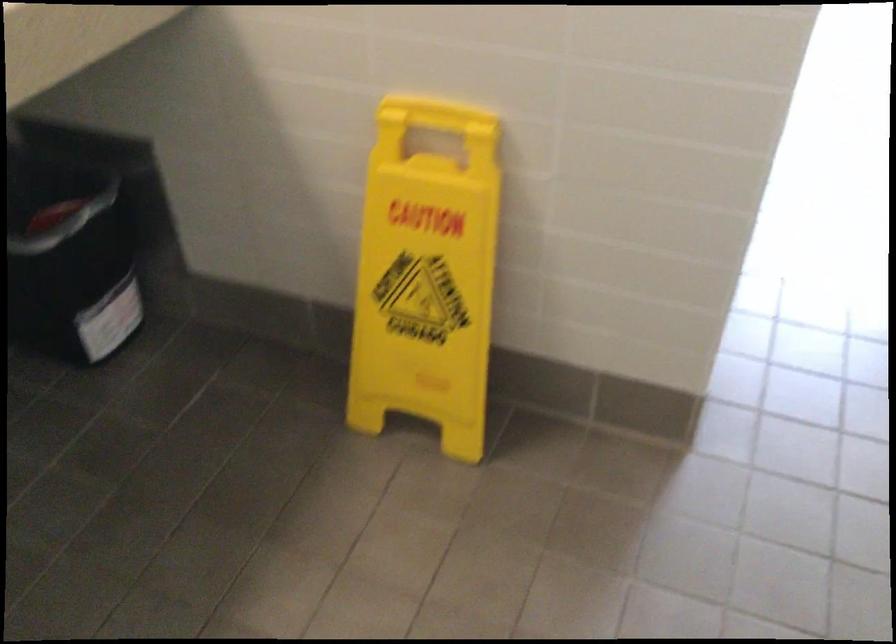
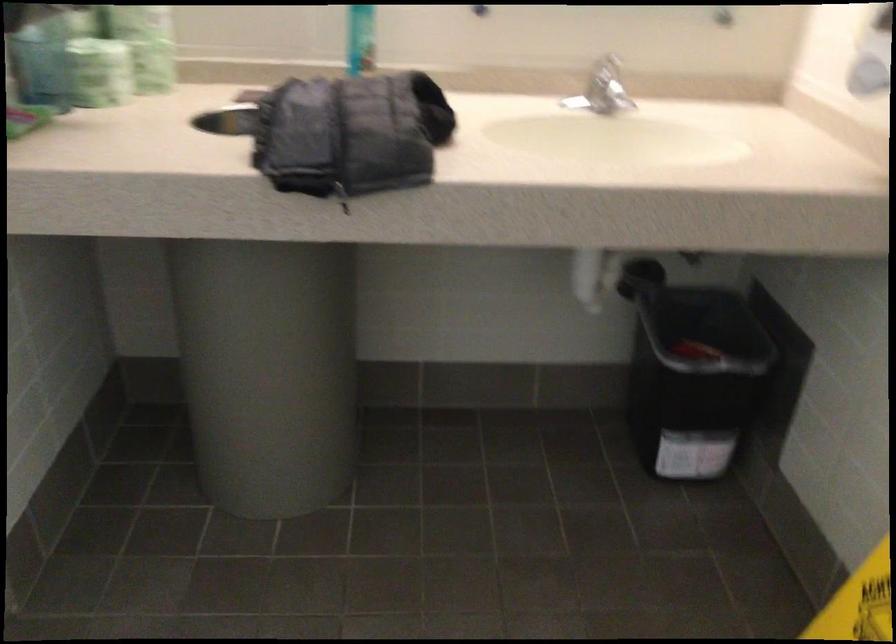
Find the pixel in the second image that matches point 73,249 in the first image.

(691, 373)